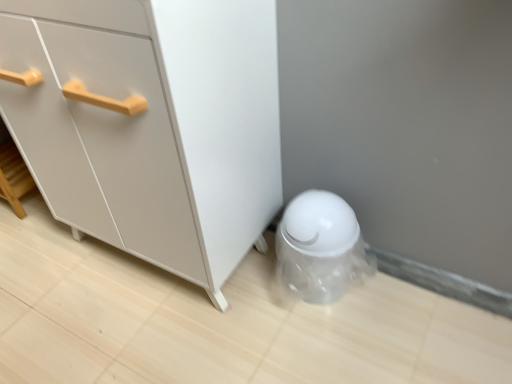
At what (x,y) coordinates should I click in order to perform the action: click on vacant area that lies between white matte cabinet at center and transparent plastic trash can at lower right. Please return your answer as a coordinate pair (x, y). The width and height of the screenshot is (512, 384). Looking at the image, I should click on (267, 302).